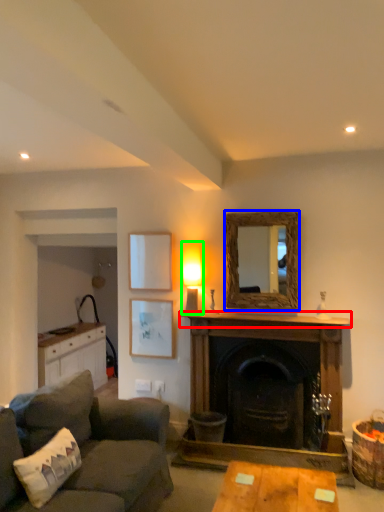
Question: Which object is positioned farthest from mantle (highlighted by a red box)? Select from mirror (highlighted by a blue box) and lamp (highlighted by a green box).

Choices:
 (A) mirror
 (B) lamp

Answer: (B)